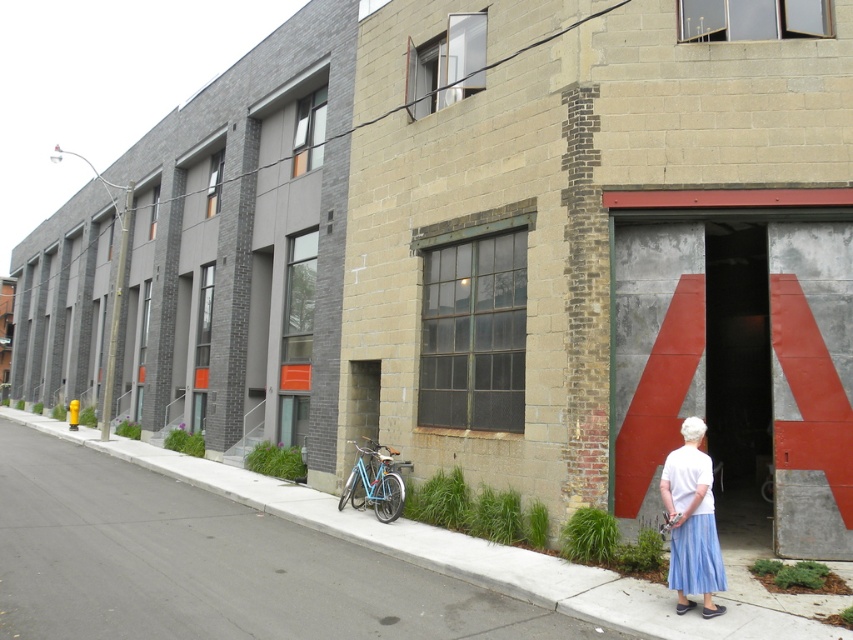
Between light blue pleated skirt at lower right and light blue matte bicycle at lower center, which one has less height?

light blue matte bicycle at lower center is shorter.

Does light blue pleated skirt at lower right appear under light blue matte bicycle at lower center?

Incorrect, light blue pleated skirt at lower right is not positioned below light blue matte bicycle at lower center.

Does point (669, 456) come in front of point (376, 477)?

Yes, point (669, 456) is in front of point (376, 477).

This screenshot has width=853, height=640. What are the coordinates of `light blue pleated skirt at lower right` in the screenshot? It's located at (692, 524).

Which is behind, point (592, 595) or point (397, 493)?

The point (397, 493) is behind.

In the scene shown: Is gray asphalt pavement at lower center to the right of light blue matte bicycle at lower center from the viewer's perspective?

In fact, gray asphalt pavement at lower center is to the left of light blue matte bicycle at lower center.

Does point (614, 604) lie behind point (399, 493)?

No.

Locate an element on the screen. gray asphalt pavement at lower center is located at coordinates (459, 552).

Based on the photo, measure the distance between point [286,515] and camera.

Point [286,515] is 10.40 meters from camera.

Looking at this image, does gray asphalt pavement at lower center appear on the right side of light blue pleated skirt at lower right?

No, gray asphalt pavement at lower center is not to the right of light blue pleated skirt at lower right.

Who is more distant from viewer, (x=553, y=598) or (x=703, y=452)?

The point (x=703, y=452) is behind.

Find the location of a particular element. The image size is (853, 640). gray asphalt pavement at lower center is located at coordinates (459, 552).